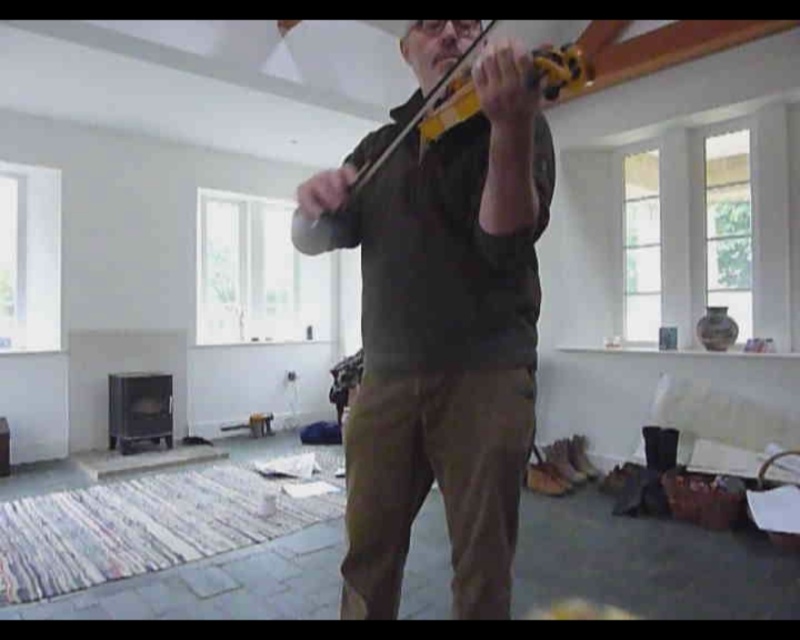
Question: Is matte black violin at center wider than yellow matte violin at center?

Choices:
 (A) no
 (B) yes

Answer: (B)

Question: Which of the following is the farthest from the observer?

Choices:
 (A) matte black violin at center
 (B) yellow matte violin at center

Answer: (B)

Question: Can you confirm if matte black violin at center is thinner than yellow matte violin at center?

Choices:
 (A) no
 (B) yes

Answer: (A)

Question: Where is matte black violin at center located in relation to yellow matte violin at center in the image?

Choices:
 (A) above
 (B) below

Answer: (B)